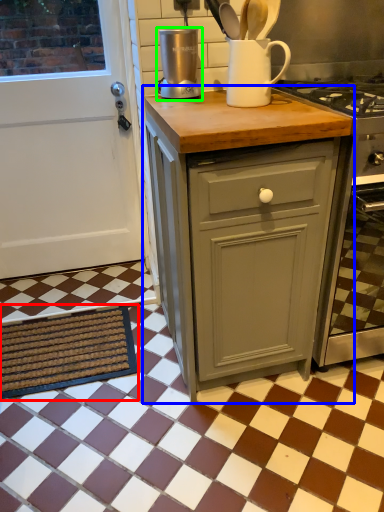
Question: Which object is the farthest from doormat (highlighted by a red box)? Choose among these: cabinetry (highlighted by a blue box) or kitchen appliance (highlighted by a green box).

Choices:
 (A) cabinetry
 (B) kitchen appliance

Answer: (B)